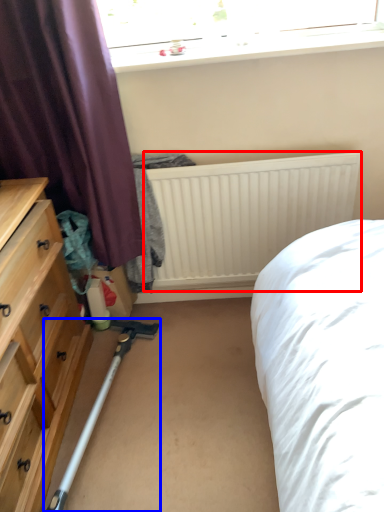
Question: Which point is further to the camera, radiator (highlighted by a red box) or equipment (highlighted by a blue box)?

Choices:
 (A) radiator
 (B) equipment

Answer: (A)